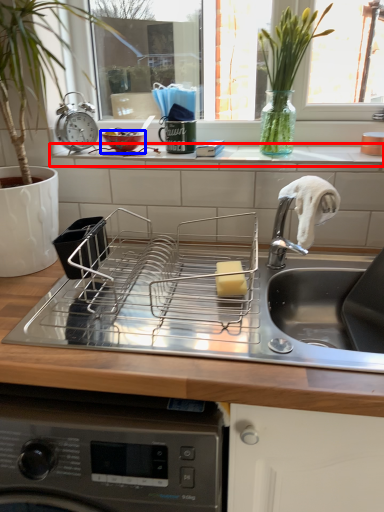
Question: Which object is closer to the camera taking this photo, window sill (highlighted by a red box) or basin (highlighted by a blue box)?

Choices:
 (A) window sill
 (B) basin

Answer: (A)